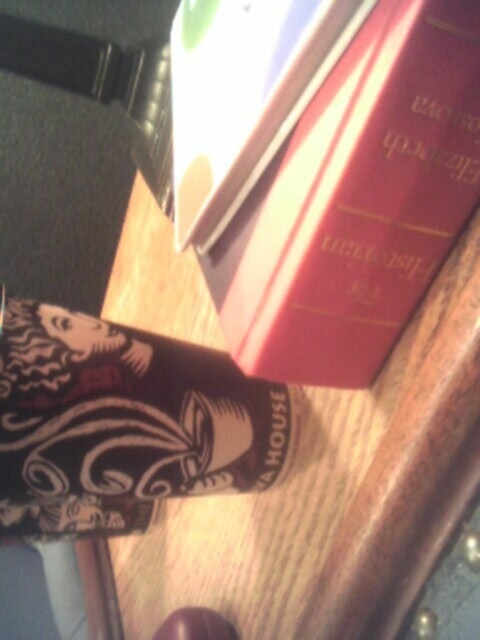
Question: Does matte red book at center have a lesser width compared to matte black book at center?

Choices:
 (A) yes
 (B) no

Answer: (A)

Question: Is matte red book at center closer to camera compared to matte black book at center?

Choices:
 (A) no
 (B) yes

Answer: (B)

Question: Which of the following is the closest to the observer?

Choices:
 (A) matte black book at center
 (B) matte red book at center

Answer: (B)

Question: Which point is farther from the camera taking this photo?

Choices:
 (A) (276, 461)
 (B) (204, 157)

Answer: (A)

Question: Can you confirm if matte red book at center is smaller than matte black book at center?

Choices:
 (A) no
 (B) yes

Answer: (B)